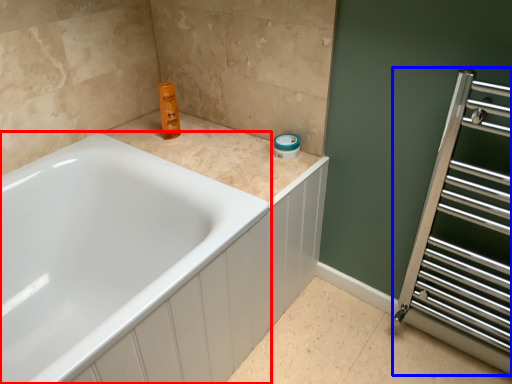
Question: Which object is closer to the camera taking this photo, bathtub (highlighted by a red box) or screen door (highlighted by a blue box)?

Choices:
 (A) bathtub
 (B) screen door

Answer: (A)